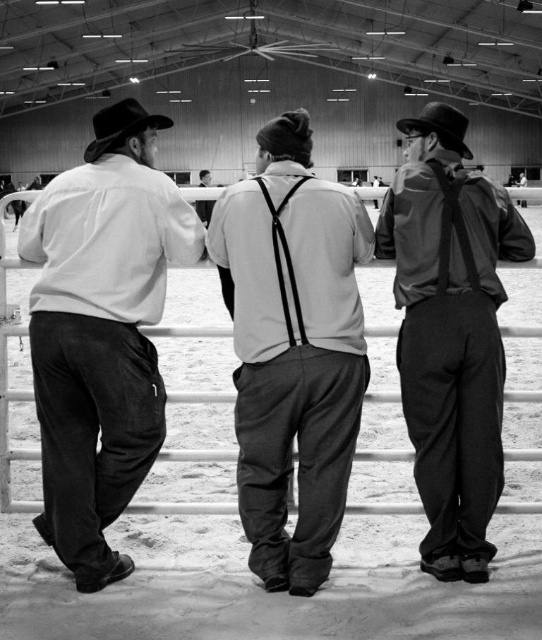
You are a photographer taking a picture of the matte black suspenders at center and the rustic leather cowboy hat at center. Which object will appear larger in your photo?

The matte black suspenders at center will appear larger in the photo because it is closer to the viewer than the rustic leather cowboy hat at center.